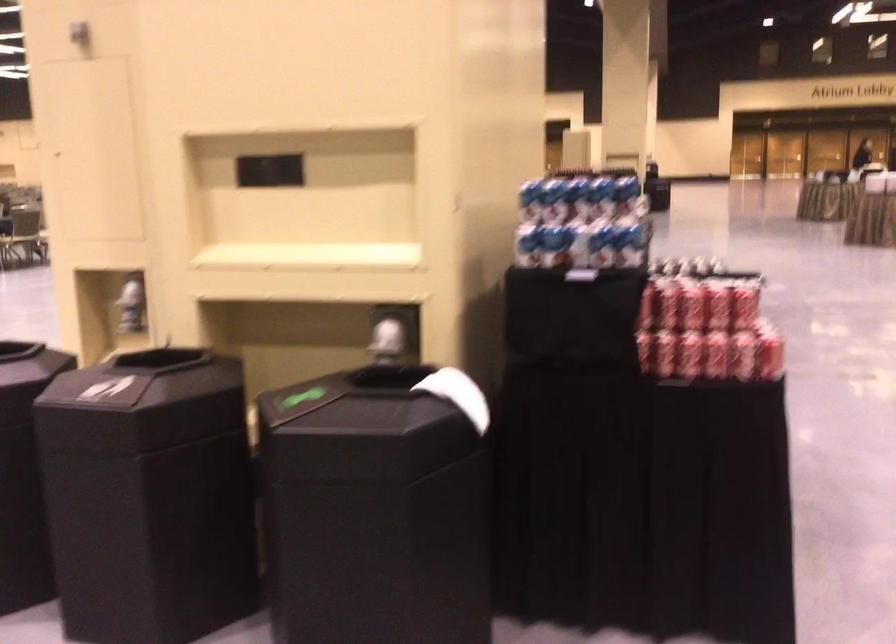
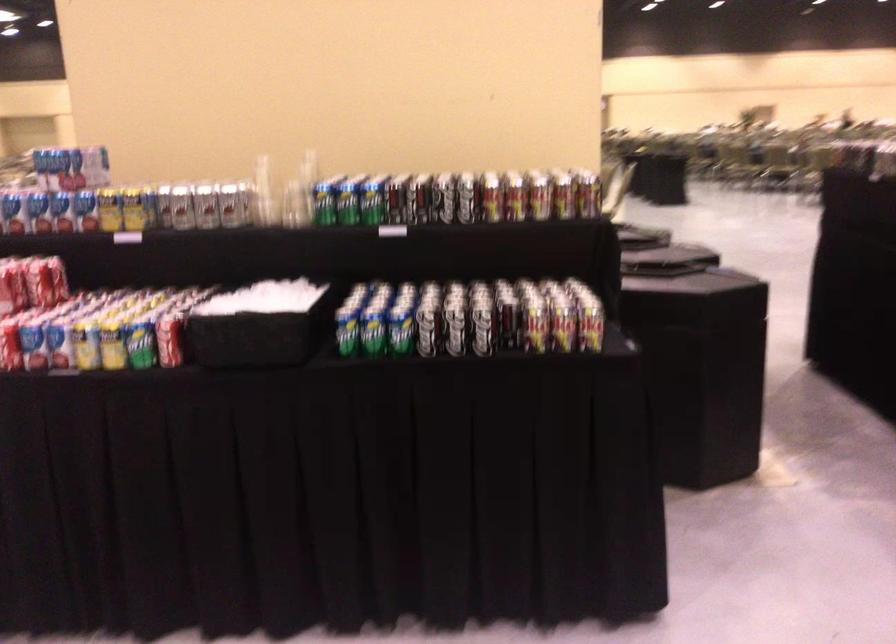
In the second image, find the point that corresponds to the point at 720,299 in the first image.

(12, 287)